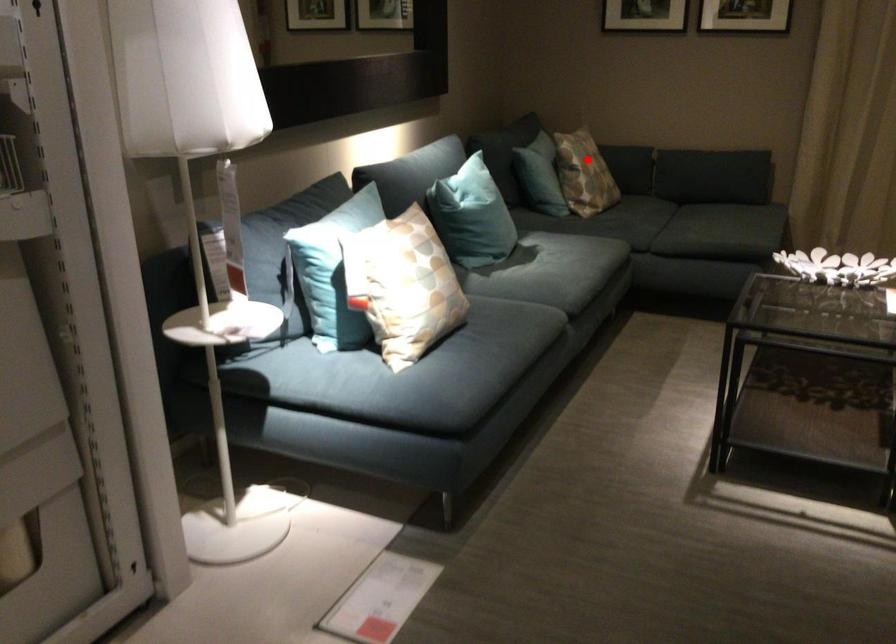
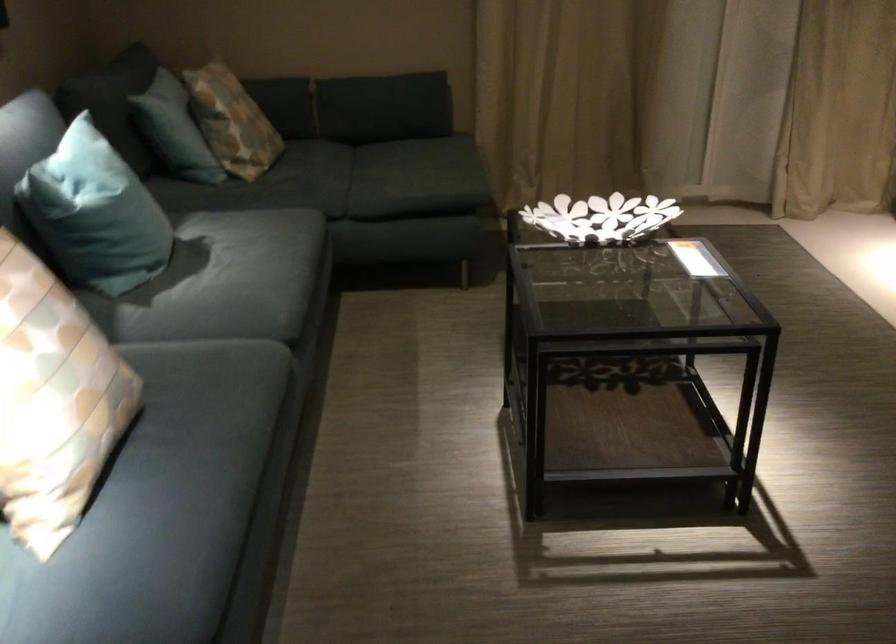
Question: I am providing you with two images of the same scene from different viewpoints. Image1 has a red point marked. In image2, the corresponding 3D location appears at what relative position? Reply with the corresponding letter.

Choices:
 (A) Closer
 (B) Farther

Answer: (A)